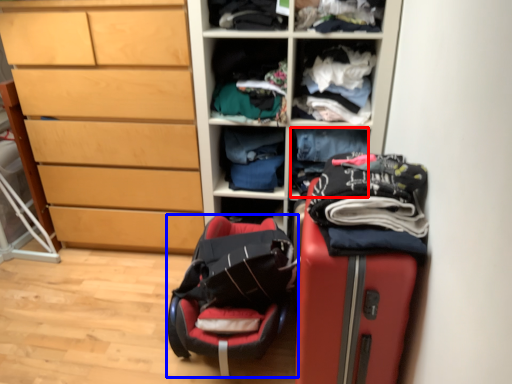
Question: Which object appears farthest to the camera in this image, clothing (highlighted by a red box) or luggage (highlighted by a blue box)?

Choices:
 (A) clothing
 (B) luggage

Answer: (A)